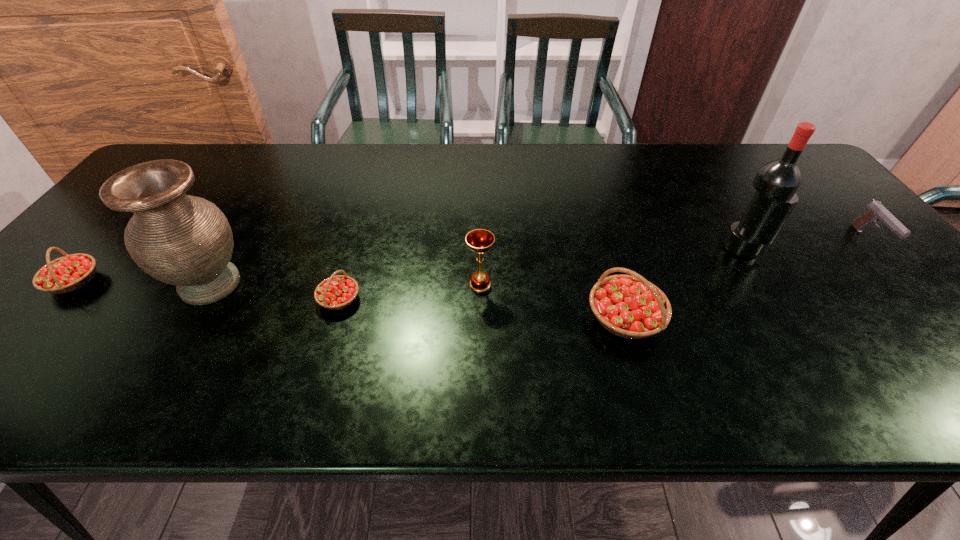
In the current image, all strawberrys are evenly spaced. To maintain this equal spacing, where should an additional strawberry be placed on the right? Please point out a free spot. Please provide its 2D coordinates. Your answer should be formatted as a tuple, i.e. [(x, y)], where the tuple contains the x and y coordinates of a point satisfying the conditions above.

[(934, 338)]